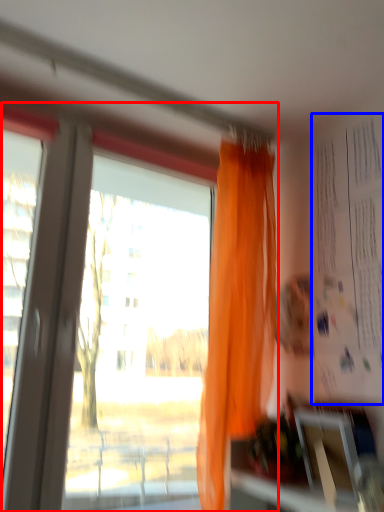
Question: Which object appears farthest to the camera in this image, window (highlighted by a red box) or bulletin board (highlighted by a blue box)?

Choices:
 (A) window
 (B) bulletin board

Answer: (B)